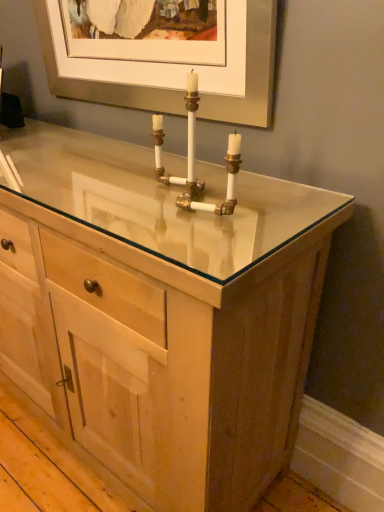
Question: Is white brass pipe at center thinner than natural wood cabinet at center?

Choices:
 (A) yes
 (B) no

Answer: (A)

Question: Is the surface of white brass pipe at center in direct contact with natural wood cabinet at center?

Choices:
 (A) yes
 (B) no

Answer: (B)

Question: Is white brass pipe at center smaller than natural wood cabinet at center?

Choices:
 (A) no
 (B) yes

Answer: (B)

Question: From a real-world perspective, does white brass pipe at center sit lower than natural wood cabinet at center?

Choices:
 (A) no
 (B) yes

Answer: (A)

Question: Does white brass pipe at center come in front of natural wood cabinet at center?

Choices:
 (A) no
 (B) yes

Answer: (A)

Question: From a real-world perspective, does white brass pipe at center stand above natural wood cabinet at center?

Choices:
 (A) yes
 (B) no

Answer: (A)

Question: Is natural wood cabinet at center at the right side of white brass pipe at center?

Choices:
 (A) yes
 (B) no

Answer: (B)

Question: Is natural wood cabinet at center positioned beyond the bounds of white brass pipe at center?

Choices:
 (A) yes
 (B) no

Answer: (A)

Question: Is natural wood cabinet at center with white brass pipe at center?

Choices:
 (A) no
 (B) yes

Answer: (A)

Question: Is natural wood cabinet at center thinner than white brass pipe at center?

Choices:
 (A) yes
 (B) no

Answer: (B)

Question: Is natural wood cabinet at center shorter than white brass pipe at center?

Choices:
 (A) yes
 (B) no

Answer: (B)

Question: Does natural wood cabinet at center have a smaller size compared to white brass pipe at center?

Choices:
 (A) no
 (B) yes

Answer: (A)

Question: Is natural wood cabinet at center bigger or smaller than white brass pipe at center?

Choices:
 (A) big
 (B) small

Answer: (A)